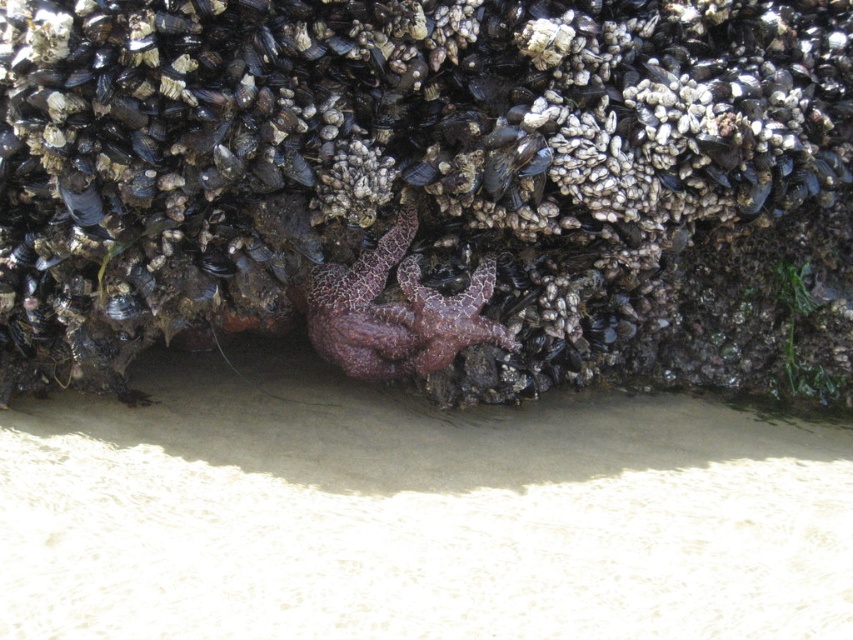
Question: Which of the following is the closest to the observer?

Choices:
 (A) purple matte starfish at center
 (B) purple coral at center
 (C) smooth dark shells at center
 (D) purple rough starfish at center

Answer: (B)

Question: Is purple coral at center thinner than purple matte starfish at center?

Choices:
 (A) no
 (B) yes

Answer: (A)

Question: Does smooth dark shells at center come in front of purple coral at center?

Choices:
 (A) no
 (B) yes

Answer: (A)

Question: Which of these objects is positioned farthest from the purple matte starfish at center?

Choices:
 (A) smooth dark shells at center
 (B) purple rough starfish at center
 (C) purple coral at center

Answer: (C)

Question: Does purple coral at center come behind purple rough starfish at center?

Choices:
 (A) yes
 (B) no

Answer: (B)

Question: Which point is farther to the camera?

Choices:
 (A) (413, 336)
 (B) (686, 428)
 (C) (358, 1)

Answer: (B)